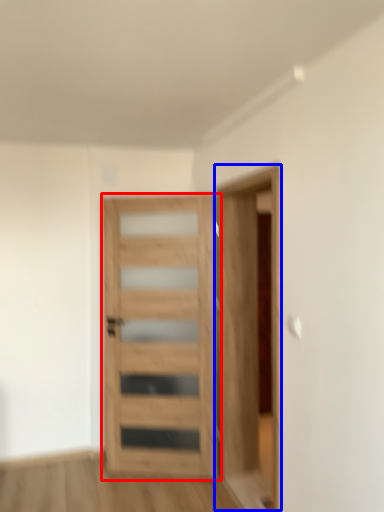
Question: Which point is closer to the camera, door (highlighted by a red box) or garage door (highlighted by a blue box)?

Choices:
 (A) door
 (B) garage door

Answer: (B)